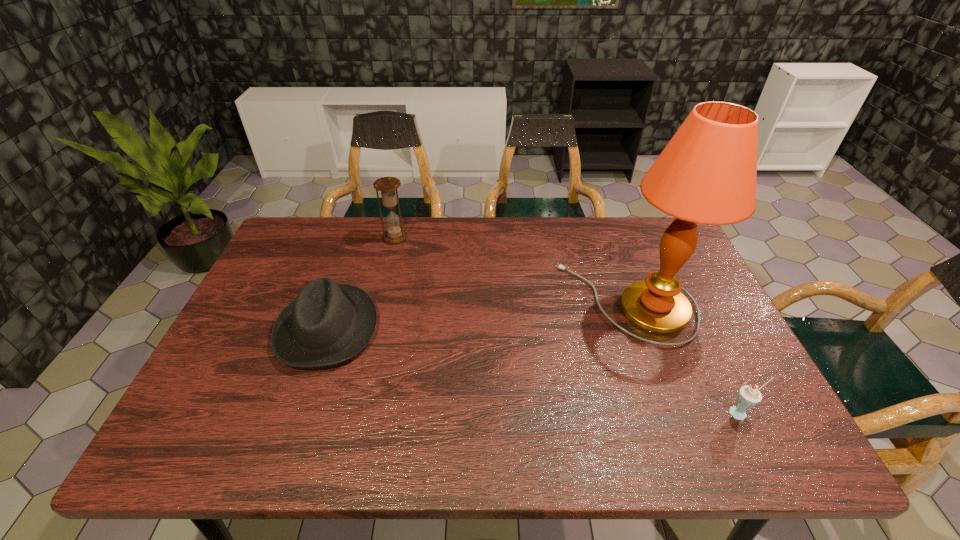
Locate an element on the screen. the tallest object is located at coordinates (706, 174).

Where is `the third shortest object`? the third shortest object is located at coordinates (395, 233).

This screenshot has height=540, width=960. What are the coordinates of `the farthest object` in the screenshot? It's located at (395, 233).

The height and width of the screenshot is (540, 960). What are the coordinates of `fedora` in the screenshot? It's located at (328, 323).

Identify the location of the nearest object. The width and height of the screenshot is (960, 540). (749, 396).

I want to click on free location located 0.120m on the left of the tallest object, so click(518, 302).

Identify the location of vacant space located 0.140m on the right of the third shortest object. The width and height of the screenshot is (960, 540). click(x=450, y=237).

The image size is (960, 540). What are the coordinates of `free spot located 0.150m on the back of the fedora` in the screenshot? It's located at (351, 256).

At what (x,y) coordinates should I click in order to perform the action: click on vacant area located 0.060m on the straw side of the milkshake. Please return your answer as a coordinate pair (x, y). Image resolution: width=960 pixels, height=540 pixels. Looking at the image, I should click on (758, 448).

Find the location of a particular element. object that is at the far edge is located at coordinates (395, 233).